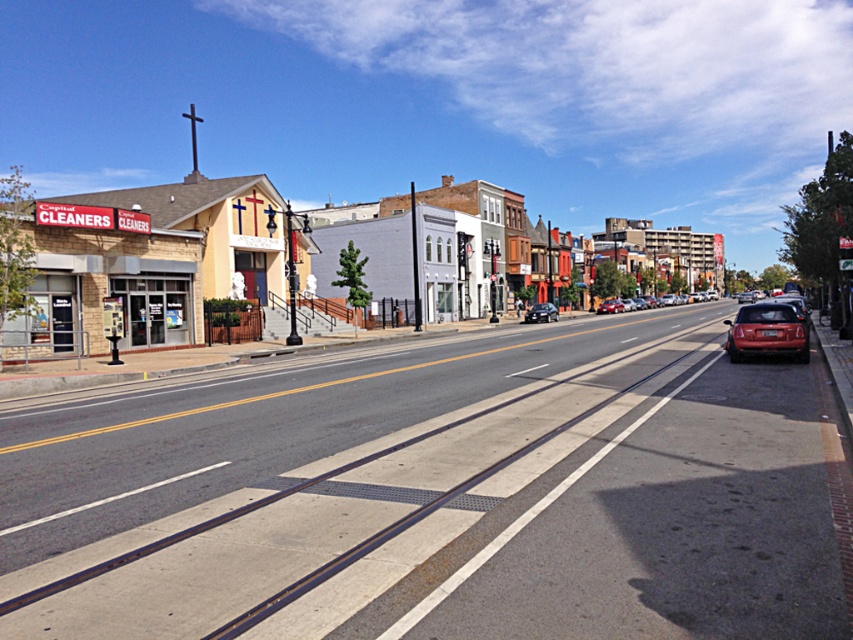
You are a delivery driver who needs to park your vehicle in a low clearance garage. You see a matte red sedan at center and a satin black sedan at center in the image. Which car should you avoid parking in the garage if the garage has a height restriction that only allows vehicles shorter than the other car?

You should avoid parking the matte red sedan at center in the garage because it has a greater height compared to the satin black sedan at center, making it less likely to fit under the height restriction.

You are standing at the camera position in the urban street scene. There is a point marked at coordinates point (668, 294). Can you walk to this point without moving closer than 100 meters from the camera? Please explain your reasoning.

The point (668, 294) is 110.18 meters away from the camera. Since this distance is greater than 100 meters, you can walk to this point without moving closer than 100 meters from the camera.